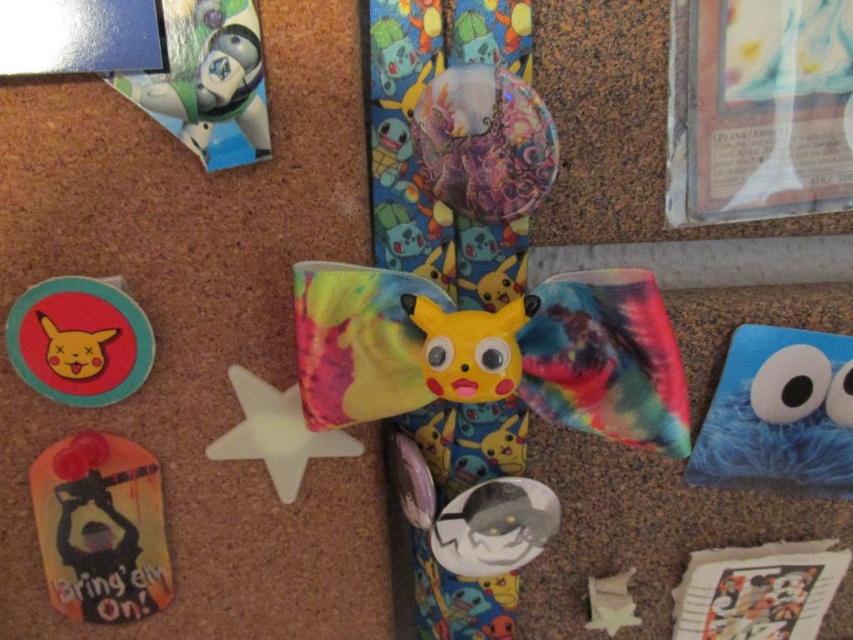
You are organizing a childrens party and need to arrange decorations. You have a blue fuzzy cookie monster at lower right and a shiny metallic buzz lightyear at upper left. Which decoration is positioned to the right side of the other?

The blue fuzzy cookie monster at lower right is positioned to the right of the shiny metallic buzz lightyear at upper left.

You are standing in front of a corkboard with a silhouette paper bookmark at lower left. If you want to pick up the bookmark without moving your feet, can you reach it?

The silhouette paper bookmark at lower left is 3.34 feet away from the viewer. Since the average arm length is about 2.5 feet, you cannot reach it without moving closer or stepping forward.